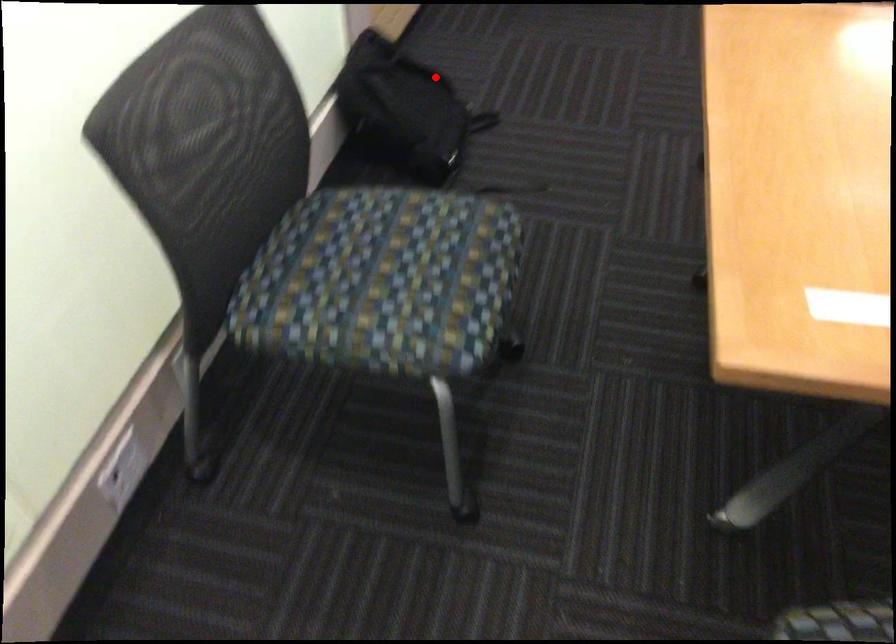
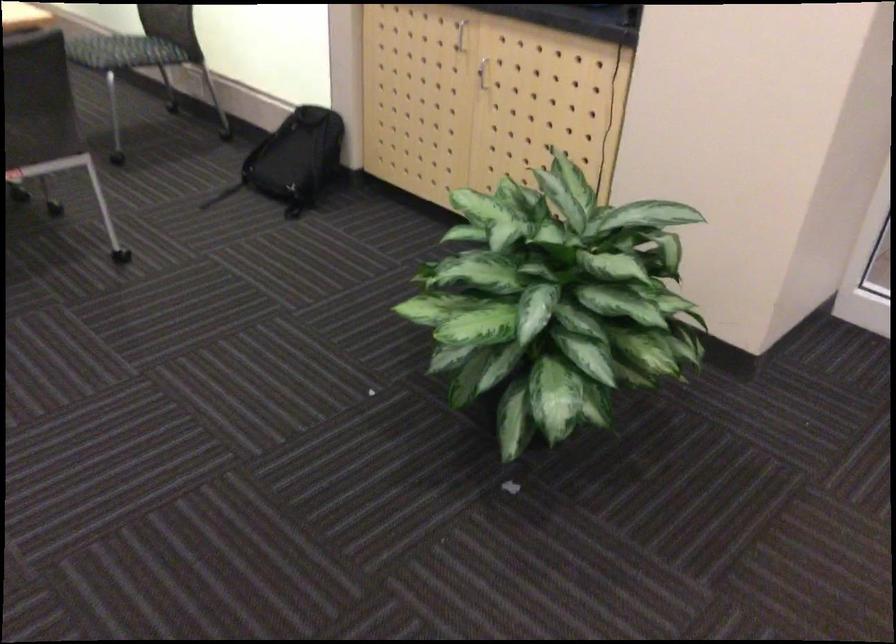
Where in the second image is the point corresponding to the highlighted location from the first image?

(293, 160)